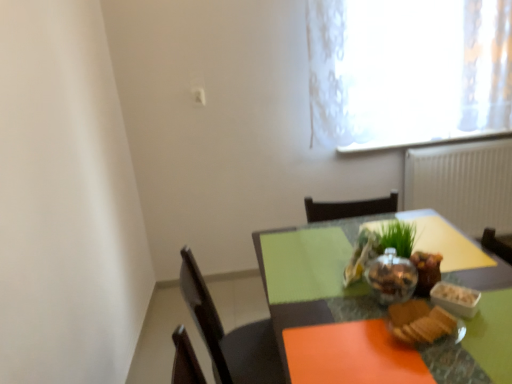
Question: In terms of width, does shiny metallic bowl at center, the second food from the front, look wider or thinner when compared to green glass table at center?

Choices:
 (A) thin
 (B) wide

Answer: (A)

Question: Based on their sizes in the image, would you say shiny metallic bowl at center, the second food from the front, is bigger or smaller than green glass table at center?

Choices:
 (A) big
 (B) small

Answer: (B)

Question: Estimate the real-world distances between objects in this image. Which object is closer to the white textured radiator at right?

Choices:
 (A) slightly toasted bread at lower right, acting as the third food starting from the back
 (B) shiny metallic bowl at center, which is the third food from front to back
 (C) matte glass bowl at center
 (D) shiny metallic bowl at center, which is the 2th food in back-to-front order
 (E) green glass table at center

Answer: (E)

Question: Which is nearer to the shiny metallic bowl at center, the second food from the front?

Choices:
 (A) matte glass bowl at center
 (B) slightly toasted bread at lower right, acting as the third food starting from the back
 (C) white textured radiator at right
 (D) green glass table at center
 (E) shiny metallic bowl at center, which is the third food from front to back

Answer: (A)